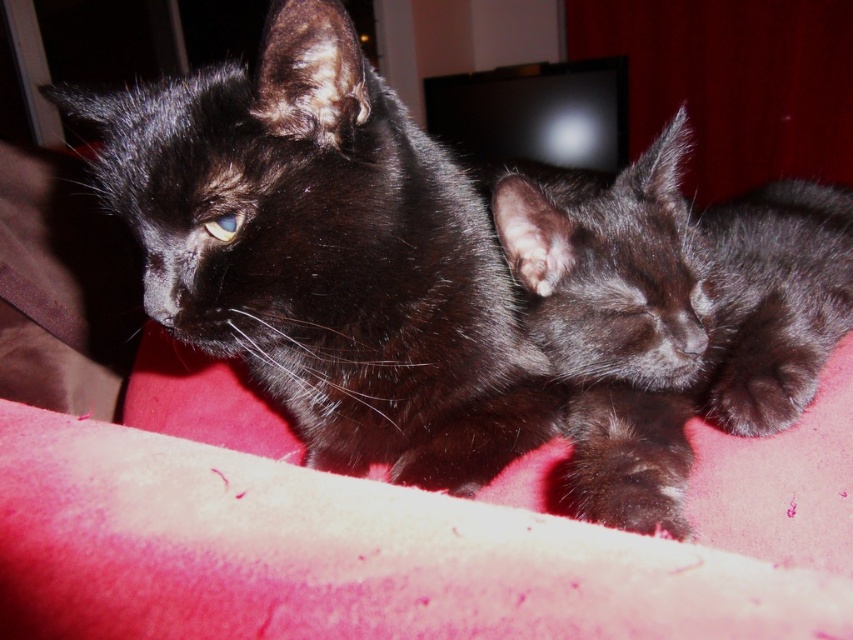
You are a photographer trying to capture both the shiny black cat at upper left and the shiny black kitten at center in a single frame. Since you want to ensure both are clearly visible, which one should you focus on first to account for their sizes?

You should focus on the shiny black kitten at center first because it is larger than the shiny black cat at upper left, ensuring its details are sharp before adjusting for the smaller one.

You are a pet sitter observing two kittens on a red blanket. You need to determine which kitten is older based on their size. The kittens are the shiny black cat at upper left and the shiny black kitten at center. Which one is likely older?

The shiny black cat at upper left is taller than the shiny black kitten at center, so the shiny black cat at upper left is likely the older one since larger size often indicates greater age in kittens.

From the picture: You are a photographer taking a picture of the two kittens on the red surface. You want to focus on the point closer to the camera. Which point should you choose between point (x=59, y=104) and point (x=664, y=520)?

Point (x=59, y=104) is further to the camera than point (x=664, y=520), so you should choose point (x=59, y=104) to focus on the point closer to the camera.